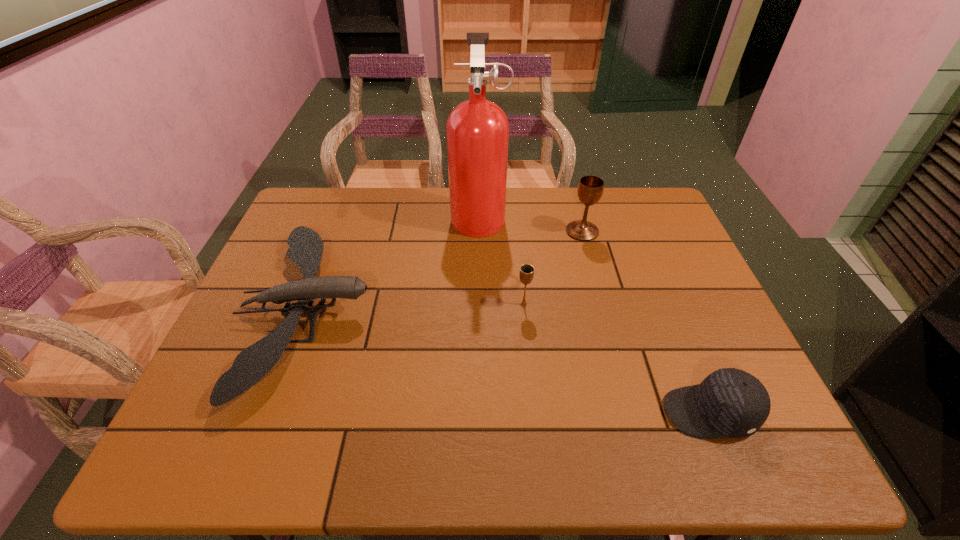
Where is `the second object from left to right`? The height and width of the screenshot is (540, 960). the second object from left to right is located at coordinates (477, 130).

Find the location of a particular element. The height and width of the screenshot is (540, 960). the tallest object is located at coordinates (477, 130).

Image resolution: width=960 pixels, height=540 pixels. I want to click on the fourth shortest object, so click(590, 188).

Locate an element on the screen. the right chalice is located at coordinates (590, 188).

The width and height of the screenshot is (960, 540). Find the location of `the third object from left to right`. the third object from left to right is located at coordinates (526, 274).

This screenshot has width=960, height=540. What are the coordinates of `the shorter chalice` in the screenshot? It's located at (526, 274).

Locate an element on the screen. drone is located at coordinates (306, 247).

Find the location of a particular element. The height and width of the screenshot is (540, 960). baseball cap is located at coordinates (729, 403).

Find the location of a particular element. This screenshot has height=540, width=960. vacant space located on the front of the tallest object is located at coordinates (479, 327).

This screenshot has width=960, height=540. Identify the location of vacant space located 0.160m on the back of the farther chalice. (572, 193).